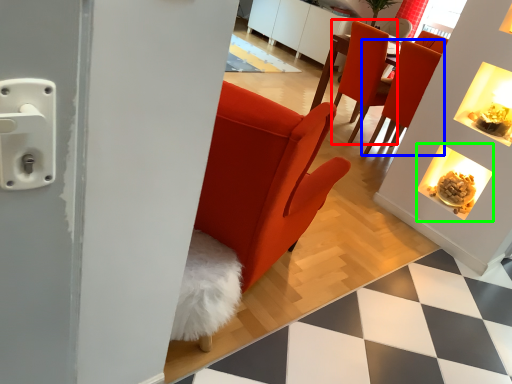
Question: Which object is positioned farthest from chair (highlighted by a red box)? Select from chair (highlighted by a blue box) and fireplace (highlighted by a green box).

Choices:
 (A) chair
 (B) fireplace

Answer: (B)